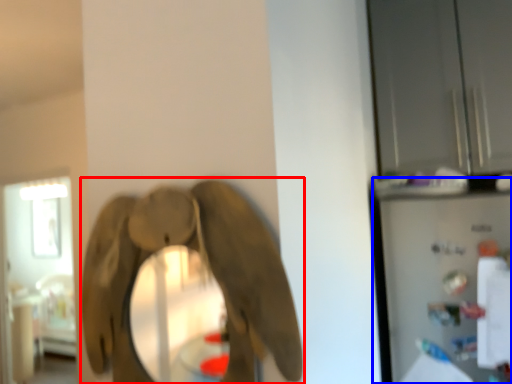
Question: Which point is closer to the camera, elephant (highlighted by a red box) or appliance (highlighted by a blue box)?

Choices:
 (A) elephant
 (B) appliance

Answer: (A)